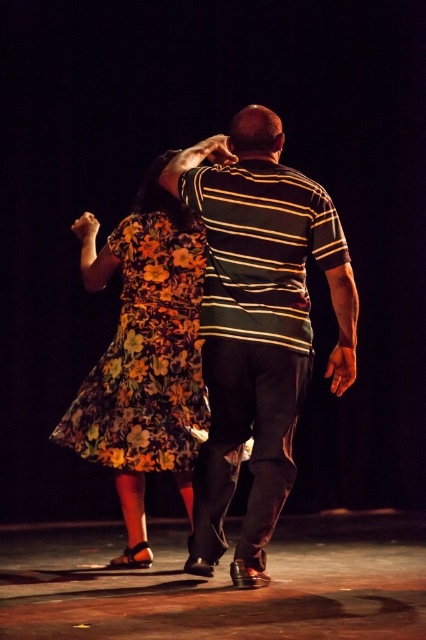
You are a photographer at the back of the stage. You want to take a photo of the striped cotton shirt at center. You have a camera with a zoom lens that can focus on objects within a 0.5 unit radius. Is the point at coordinates point (x=258, y=324) within the focus range of your camera?

The point (x=258, y=324) marks the striped cotton shirt at center, so yes, the camera can focus on the striped cotton shirt at center as the point is within the 0.5 unit radius.